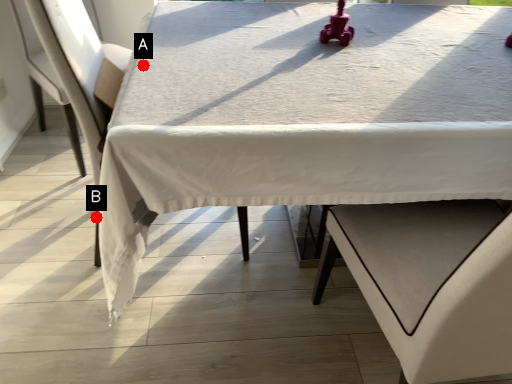
Question: Two points are circled on the image, labeled by A and B beside each circle. Among these points, which one is farthest from the camera?

Choices:
 (A) A is further
 (B) B is further

Answer: (A)